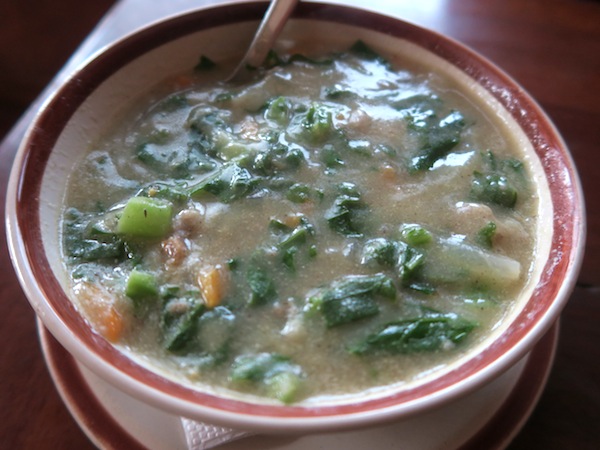
Image resolution: width=600 pixels, height=450 pixels. I want to click on spoon, so click(260, 42).